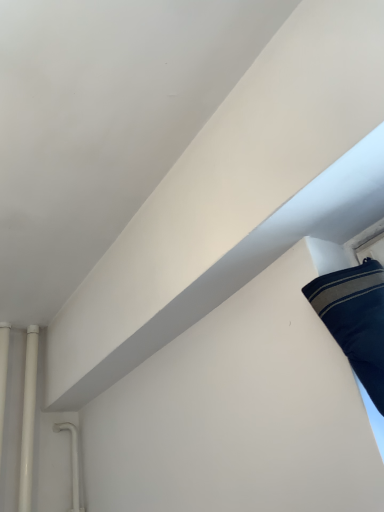
What is the approximate width of white glossy pipe at left, marked as the first pipe in a right-to-left arrangement?

white glossy pipe at left, marked as the first pipe in a right-to-left arrangement, is 1.58 inches in width.

Identify the location of white glossy pipe at left, the second pipe when ordered from left to right. (28, 419).

The image size is (384, 512). Describe the element at coordinates (28, 419) in the screenshot. I see `white glossy pipe at left, the second pipe when ordered from left to right` at that location.

Measure the distance between white glossy pipe at left, the second pipe when ordered from left to right, and camera.

They are 1.37 meters apart.

This screenshot has height=512, width=384. Identify the location of white glossy pipe at left, the second pipe from the right. (3, 373).

Consider the image. Measure the distance between white glossy pipe at left, the second pipe from the right, and camera.

white glossy pipe at left, the second pipe from the right, is 1.41 meters from camera.

The width and height of the screenshot is (384, 512). Describe the element at coordinates (3, 373) in the screenshot. I see `white glossy pipe at left, the second pipe from the right` at that location.

The height and width of the screenshot is (512, 384). I want to click on white glossy pipe at left, marked as the first pipe in a right-to-left arrangement, so click(x=28, y=419).

Is white glossy pipe at left, the second pipe when ordered from left to right, at the left side of white glossy pipe at left, the second pipe from the right?

No, white glossy pipe at left, the second pipe when ordered from left to right, is not to the left of white glossy pipe at left, the second pipe from the right.

Is the depth of white glossy pipe at left, marked as the first pipe in a right-to-left arrangement, greater than that of white glossy pipe at left, the second pipe from the right?

Yes, white glossy pipe at left, marked as the first pipe in a right-to-left arrangement, is behind white glossy pipe at left, the second pipe from the right.

Which is nearer, [26,415] or [1,381]?

Point [26,415] appears to be closer to the viewer than point [1,381].

From the image's perspective, is white glossy pipe at left, marked as the first pipe in a right-to-left arrangement, located above or below white glossy pipe at left, the second pipe from the right?

white glossy pipe at left, marked as the first pipe in a right-to-left arrangement, is situated lower than white glossy pipe at left, the second pipe from the right, in the image.

From the picture: From a real-world perspective, is white glossy pipe at left, the second pipe when ordered from left to right, physically below white glossy pipe at left, marked as the first pipe in a left-to-right arrangement?

Yes, from a real-world perspective, white glossy pipe at left, the second pipe when ordered from left to right, is beneath white glossy pipe at left, marked as the first pipe in a left-to-right arrangement.

Considering the relative sizes of white glossy pipe at left, marked as the first pipe in a right-to-left arrangement, and white glossy pipe at left, marked as the first pipe in a left-to-right arrangement, in the image provided, is white glossy pipe at left, marked as the first pipe in a right-to-left arrangement, thinner than white glossy pipe at left, marked as the first pipe in a left-to-right arrangement,?

No.

Can you confirm if white glossy pipe at left, marked as the first pipe in a right-to-left arrangement, is taller than white glossy pipe at left, the second pipe from the right?

Yes.

Who is smaller, white glossy pipe at left, marked as the first pipe in a right-to-left arrangement, or white glossy pipe at left, the second pipe from the right?

With smaller size is white glossy pipe at left, the second pipe from the right.

Is white glossy pipe at left, the second pipe when ordered from left to right, positioned beyond the bounds of white glossy pipe at left, the second pipe from the right?

Absolutely, white glossy pipe at left, the second pipe when ordered from left to right, is external to white glossy pipe at left, the second pipe from the right.

Is white glossy pipe at left, the second pipe when ordered from left to right, not near white glossy pipe at left, marked as the first pipe in a left-to-right arrangement?

No, white glossy pipe at left, the second pipe when ordered from left to right, is in close proximity to white glossy pipe at left, marked as the first pipe in a left-to-right arrangement.

Is white glossy pipe at left, the second pipe when ordered from left to right, aimed at white glossy pipe at left, the second pipe from the right?

No, white glossy pipe at left, the second pipe when ordered from left to right, does not turn towards white glossy pipe at left, the second pipe from the right.

Find the location of a particular element. This screenshot has width=384, height=512. pipe behind the white glossy pipe at left, the second pipe from the right is located at coordinates (28, 419).

Does white glossy pipe at left, marked as the first pipe in a left-to-right arrangement, appear on the left side of white glossy pipe at left, marked as the first pipe in a right-to-left arrangement?

Correct, you'll find white glossy pipe at left, marked as the first pipe in a left-to-right arrangement, to the left of white glossy pipe at left, marked as the first pipe in a right-to-left arrangement.

Is white glossy pipe at left, the second pipe from the right, in front of or behind white glossy pipe at left, the second pipe when ordered from left to right, in the image?

white glossy pipe at left, the second pipe from the right, is positioned closer to the viewer than white glossy pipe at left, the second pipe when ordered from left to right.

Does point (4, 325) come behind point (31, 503)?

That is True.

From the image's perspective, which one is positioned lower, white glossy pipe at left, marked as the first pipe in a left-to-right arrangement, or white glossy pipe at left, the second pipe when ordered from left to right?

white glossy pipe at left, the second pipe when ordered from left to right, is shown below in the image.

From a real-world perspective, does white glossy pipe at left, marked as the first pipe in a left-to-right arrangement, sit lower than white glossy pipe at left, marked as the first pipe in a right-to-left arrangement?

No.

Considering the relative sizes of white glossy pipe at left, the second pipe from the right, and white glossy pipe at left, the second pipe when ordered from left to right, in the image provided, is white glossy pipe at left, the second pipe from the right, thinner than white glossy pipe at left, the second pipe when ordered from left to right,?

Yes.

Which of these two, white glossy pipe at left, marked as the first pipe in a left-to-right arrangement, or white glossy pipe at left, marked as the first pipe in a right-to-left arrangement, stands taller?

Standing taller between the two is white glossy pipe at left, marked as the first pipe in a right-to-left arrangement.

In the scene shown: Can you confirm if white glossy pipe at left, marked as the first pipe in a left-to-right arrangement, is bigger than white glossy pipe at left, marked as the first pipe in a right-to-left arrangement?

Actually, white glossy pipe at left, marked as the first pipe in a left-to-right arrangement, might be smaller than white glossy pipe at left, marked as the first pipe in a right-to-left arrangement.

Is white glossy pipe at left, the second pipe when ordered from left to right, inside white glossy pipe at left, the second pipe from the right?

Actually, white glossy pipe at left, the second pipe when ordered from left to right, is outside white glossy pipe at left, the second pipe from the right.

Are white glossy pipe at left, the second pipe from the right, and white glossy pipe at left, marked as the first pipe in a right-to-left arrangement, beside each other?

Yes, white glossy pipe at left, the second pipe from the right, is touching white glossy pipe at left, marked as the first pipe in a right-to-left arrangement.

Could you tell me if white glossy pipe at left, the second pipe from the right, is turned towards white glossy pipe at left, the second pipe when ordered from left to right?

No, white glossy pipe at left, the second pipe from the right, is not turned towards white glossy pipe at left, the second pipe when ordered from left to right.

Can you tell me how much white glossy pipe at left, the second pipe from the right, and white glossy pipe at left, the second pipe when ordered from left to right, differ in facing direction?

white glossy pipe at left, the second pipe from the right, and white glossy pipe at left, the second pipe when ordered from left to right, are facing 0.00205 degrees away from each other.

Where is `pipe in front of the white glossy pipe at left, the second pipe when ordered from left to right`? pipe in front of the white glossy pipe at left, the second pipe when ordered from left to right is located at coordinates (3, 373).

The width and height of the screenshot is (384, 512). I want to click on pipe that is above the white glossy pipe at left, the second pipe when ordered from left to right (from the image's perspective), so click(x=3, y=373).

Find the location of `pipe on the right of white glossy pipe at left, the second pipe from the right`. pipe on the right of white glossy pipe at left, the second pipe from the right is located at coordinates click(28, 419).